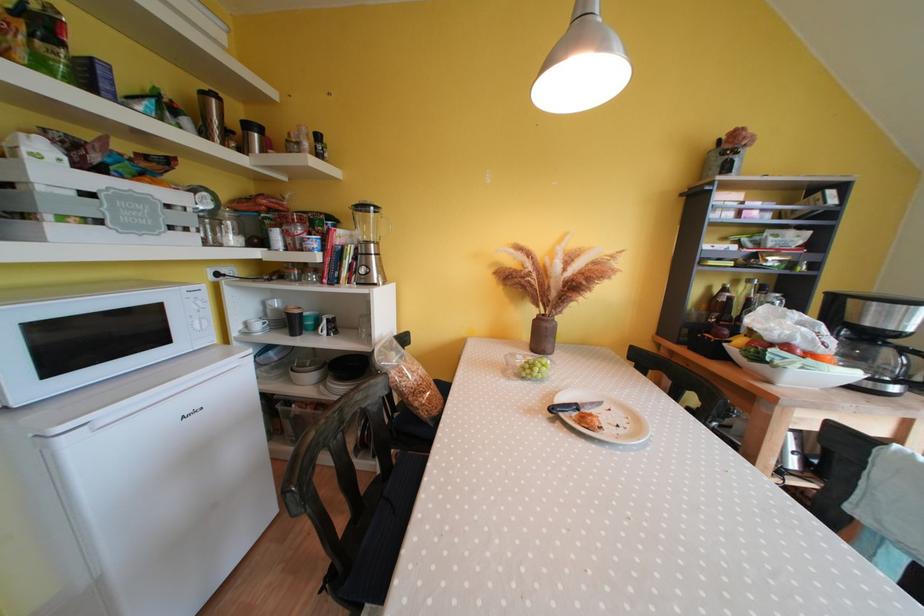
Locate an element on the screen. The width and height of the screenshot is (924, 616). blender control dial is located at coordinates (369, 270).